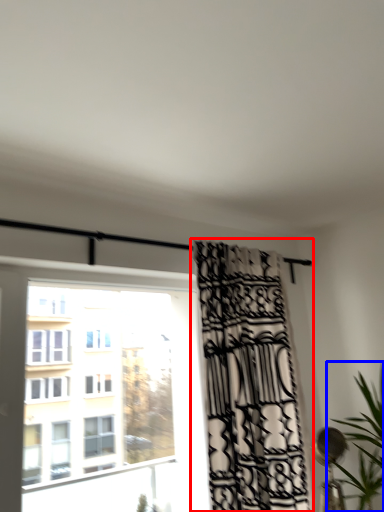
Question: Which object appears closest to the camera in this image, curtain (highlighted by a red box) or houseplant (highlighted by a blue box)?

Choices:
 (A) curtain
 (B) houseplant

Answer: (B)